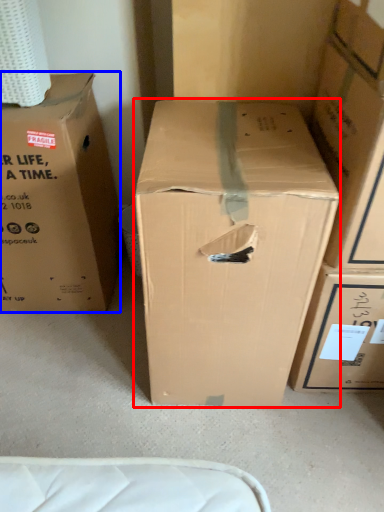
Question: Which point is closer to the camera, box (highlighted by a red box) or box (highlighted by a blue box)?

Choices:
 (A) box
 (B) box

Answer: (A)